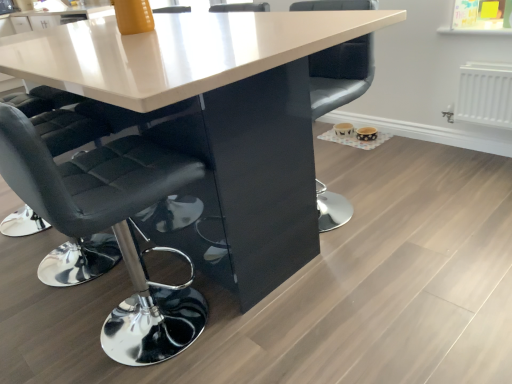
Question: Is black leather chair at left, which appears as the 1th chair when viewed from the left, positioned before black leather chair at center, which is the second chair in left-to-right order?

Choices:
 (A) no
 (B) yes

Answer: (B)

Question: Is black leather chair at left, acting as the second chair starting from the right, positioned with its back to black leather chair at center, arranged as the first chair when viewed from the right?

Choices:
 (A) no
 (B) yes

Answer: (A)

Question: Does black leather chair at left, which appears as the 1th chair when viewed from the left, appear on the right side of black leather chair at center, which is the second chair in left-to-right order?

Choices:
 (A) no
 (B) yes

Answer: (A)

Question: Considering the relative sizes of black leather chair at left, which appears as the 1th chair when viewed from the left, and black leather chair at center, arranged as the first chair when viewed from the right, in the image provided, is black leather chair at left, which appears as the 1th chair when viewed from the left, wider than black leather chair at center, arranged as the first chair when viewed from the right,?

Choices:
 (A) yes
 (B) no

Answer: (A)

Question: Can you confirm if black leather chair at left, which appears as the 1th chair when viewed from the left, is shorter than black leather chair at center, arranged as the first chair when viewed from the right?

Choices:
 (A) no
 (B) yes

Answer: (A)

Question: From the image's perspective, is black leather chair at left, which appears as the 1th chair when viewed from the left, located beneath black leather chair at center, which is the second chair in left-to-right order?

Choices:
 (A) yes
 (B) no

Answer: (A)

Question: Is white glossy table at center placed right next to black leather chair at left, acting as the second chair starting from the right?

Choices:
 (A) yes
 (B) no

Answer: (B)

Question: Is white glossy table at center facing towards black leather chair at left, acting as the second chair starting from the right?

Choices:
 (A) no
 (B) yes

Answer: (B)

Question: Can you confirm if white glossy table at center is bigger than black leather chair at left, which appears as the 1th chair when viewed from the left?

Choices:
 (A) no
 (B) yes

Answer: (B)

Question: Can you confirm if white glossy table at center is positioned to the right of black leather chair at left, acting as the second chair starting from the right?

Choices:
 (A) yes
 (B) no

Answer: (B)

Question: Is white glossy table at center shorter than black leather chair at left, acting as the second chair starting from the right?

Choices:
 (A) no
 (B) yes

Answer: (B)

Question: Is white glossy table at center positioned with its back to black leather chair at left, acting as the second chair starting from the right?

Choices:
 (A) no
 (B) yes

Answer: (A)

Question: From the image's perspective, is white glossy table at center under black leather chair at center, which is the second chair in left-to-right order?

Choices:
 (A) no
 (B) yes

Answer: (B)